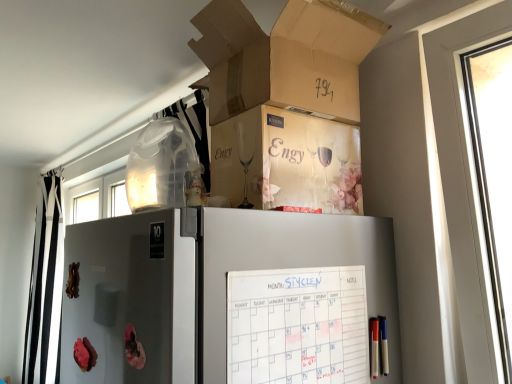
Question: Is metallic silver screen door at lower left outside cardboard box at upper center?

Choices:
 (A) yes
 (B) no

Answer: (A)

Question: Is metallic silver screen door at lower left aimed at cardboard box at upper center?

Choices:
 (A) no
 (B) yes

Answer: (A)

Question: Does metallic silver screen door at lower left come in front of cardboard box at upper center?

Choices:
 (A) yes
 (B) no

Answer: (A)

Question: Does metallic silver screen door at lower left have a greater height compared to cardboard box at upper center?

Choices:
 (A) no
 (B) yes

Answer: (B)

Question: Can you see metallic silver screen door at lower left touching cardboard box at upper center?

Choices:
 (A) yes
 (B) no

Answer: (B)

Question: Can you confirm if metallic silver screen door at lower left is smaller than cardboard box at upper center?

Choices:
 (A) yes
 (B) no

Answer: (A)

Question: From a real-world perspective, is beige cardboard box at upper center under black/white striped curtain at left?

Choices:
 (A) no
 (B) yes

Answer: (A)

Question: Can you confirm if beige cardboard box at upper center is bigger than black/white striped curtain at left?

Choices:
 (A) yes
 (B) no

Answer: (B)

Question: Does beige cardboard box at upper center appear on the left side of black/white striped curtain at left?

Choices:
 (A) yes
 (B) no

Answer: (B)

Question: From the image's perspective, is beige cardboard box at upper center over black/white striped curtain at left?

Choices:
 (A) yes
 (B) no

Answer: (A)

Question: Is beige cardboard box at upper center not inside black/white striped curtain at left?

Choices:
 (A) no
 (B) yes

Answer: (B)

Question: Can you confirm if beige cardboard box at upper center is taller than black/white striped curtain at left?

Choices:
 (A) yes
 (B) no

Answer: (B)

Question: From a real-world perspective, is black/white striped curtain at left beneath metallic silver screen door at lower left?

Choices:
 (A) no
 (B) yes

Answer: (B)